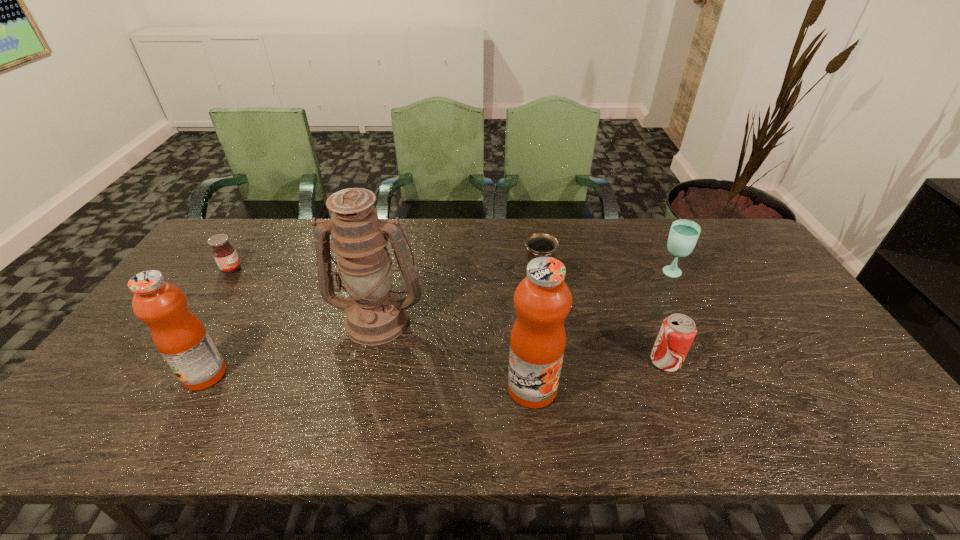
Find the location of `vacant space at the near edge`. vacant space at the near edge is located at coordinates (245, 388).

At what (x,y) coordinates should I click in order to perform the action: click on free region at the right edge of the desktop. Please return your answer as a coordinate pair (x, y). Looking at the image, I should click on (772, 300).

Find the location of `vacant space at the far left corner of the desktop`. vacant space at the far left corner of the desktop is located at coordinates (246, 237).

Locate an element on the screen. Image resolution: width=960 pixels, height=540 pixels. vacant space that is in between the second object from right to left and the chalice is located at coordinates (601, 326).

Locate an element on the screen. The width and height of the screenshot is (960, 540). empty space between the right fruit juice and the third object from left to right is located at coordinates (455, 354).

Locate an element on the screen. The width and height of the screenshot is (960, 540). vacant space in between the left fruit juice and the fifth object from right to left is located at coordinates (292, 347).

At what (x,y) coordinates should I click in order to perform the action: click on free space between the leftmost object and the soda can. Please return your answer as a coordinate pair (x, y). The width and height of the screenshot is (960, 540). Looking at the image, I should click on (448, 315).

Where is `free space between the taller fruit juice and the oil lamp`? The image size is (960, 540). free space between the taller fruit juice and the oil lamp is located at coordinates (455, 354).

Locate an element on the screen. This screenshot has width=960, height=540. free space between the oil lamp and the chalice is located at coordinates (457, 304).

Find the location of a particular element. This screenshot has width=960, height=540. vacant region between the glass and the left fruit juice is located at coordinates (438, 324).